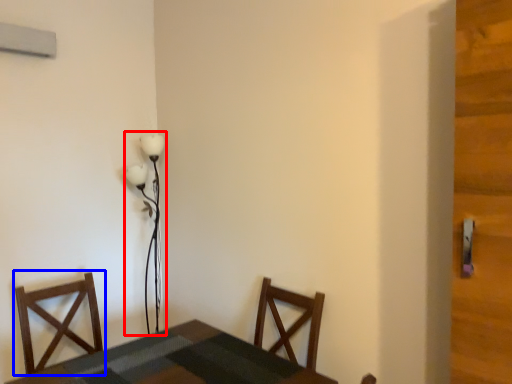
Question: Which of the following is the closest to the observer, lamp (highlighted by a red box) or chair (highlighted by a blue box)?

Choices:
 (A) lamp
 (B) chair

Answer: (B)